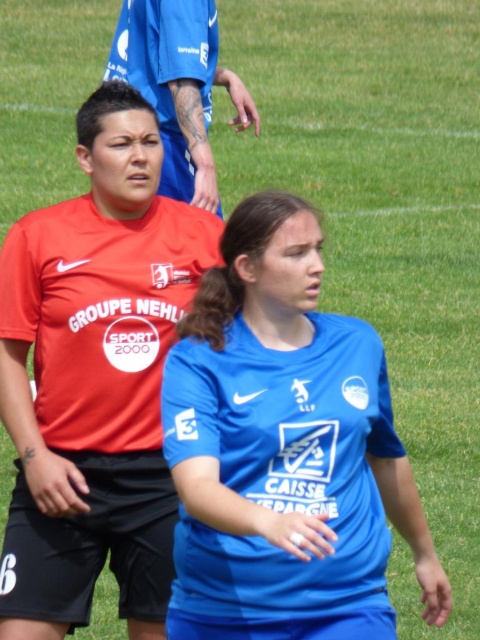
Question: Observing the image, what is the correct spatial positioning of matte red shirt at left in reference to matte blue jersey at upper center?

Choices:
 (A) above
 (B) below

Answer: (B)

Question: Is blue jersey at center bigger than matte red shirt at left?

Choices:
 (A) yes
 (B) no

Answer: (A)

Question: Which point is farther to the camera?

Choices:
 (A) blue jersey at center
 (B) matte red shirt at left
 (C) matte blue jersey at upper center

Answer: (C)

Question: Is blue jersey at center closer to camera compared to matte blue jersey at upper center?

Choices:
 (A) yes
 (B) no

Answer: (A)

Question: Among these points, which one is nearest to the camera?

Choices:
 (A) (315, 536)
 (B) (144, 474)

Answer: (A)

Question: Which object is positioned farthest from the blue jersey at center?

Choices:
 (A) matte blue jersey at upper center
 (B) matte red shirt at left

Answer: (A)